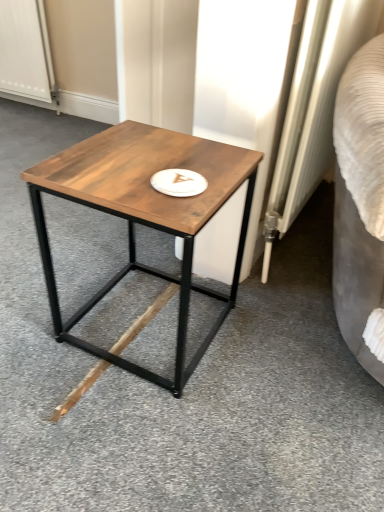
Question: Does wooden table at center have a lesser width compared to white textured radiator at right?

Choices:
 (A) no
 (B) yes

Answer: (A)

Question: Does wooden table at center appear on the right side of white textured radiator at right?

Choices:
 (A) yes
 (B) no

Answer: (B)

Question: Can you confirm if wooden table at center is positioned to the left of white textured radiator at right?

Choices:
 (A) no
 (B) yes

Answer: (B)

Question: Is the depth of wooden table at center less than that of white textured radiator at right?

Choices:
 (A) no
 (B) yes

Answer: (B)

Question: Is wooden table at center aimed at white textured radiator at right?

Choices:
 (A) no
 (B) yes

Answer: (A)

Question: Can you confirm if wooden table at center is bigger than white textured radiator at right?

Choices:
 (A) yes
 (B) no

Answer: (A)

Question: Considering the relative sizes of brown matte wood at center and wooden table at center in the image provided, is brown matte wood at center wider than wooden table at center?

Choices:
 (A) yes
 (B) no

Answer: (A)

Question: Is brown matte wood at center to the right of wooden table at center from the viewer's perspective?

Choices:
 (A) no
 (B) yes

Answer: (A)

Question: From the image's perspective, is brown matte wood at center above wooden table at center?

Choices:
 (A) no
 (B) yes

Answer: (A)

Question: From a real-world perspective, is brown matte wood at center physically above wooden table at center?

Choices:
 (A) yes
 (B) no

Answer: (B)

Question: Is brown matte wood at center not within wooden table at center?

Choices:
 (A) yes
 (B) no

Answer: (A)

Question: Is brown matte wood at center at the left side of wooden table at center?

Choices:
 (A) no
 (B) yes

Answer: (B)

Question: From the image's perspective, is wooden table at center over white textured screen door at upper left?

Choices:
 (A) yes
 (B) no

Answer: (B)